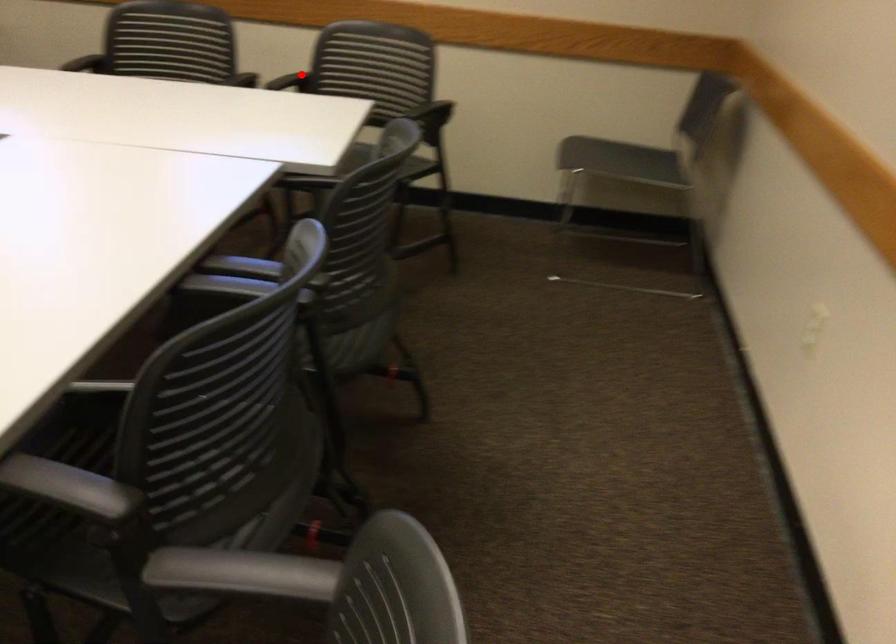
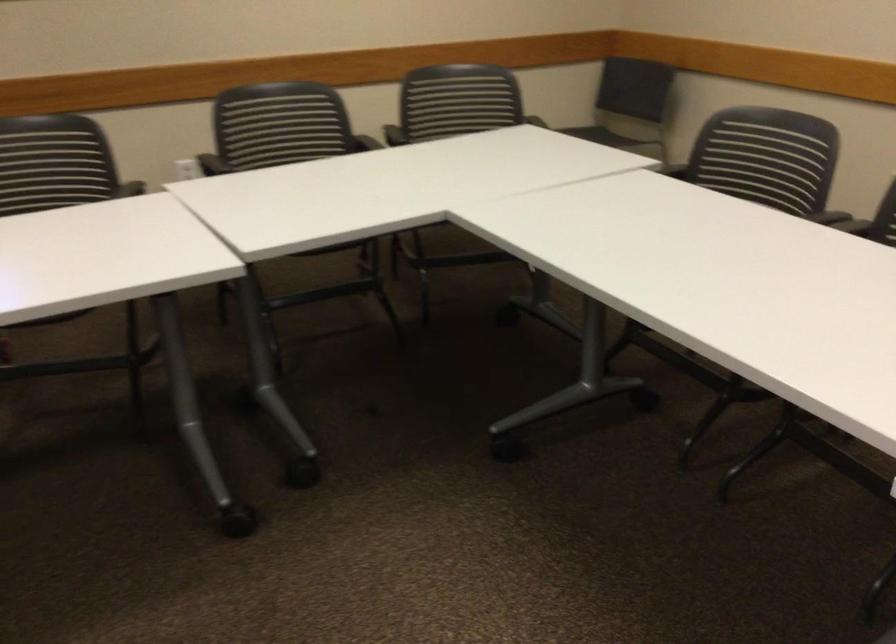
Question: I am providing you with two images of the same scene from different viewpoints. A red point is marked on the first image. Is the red point's position out of view in image 2?

Choices:
 (A) Yes
 (B) No

Answer: (A)